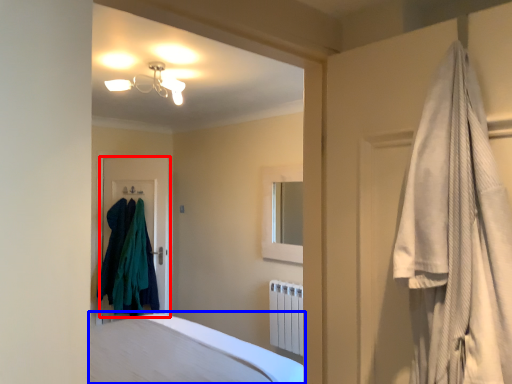
Question: Which point is closer to the camera, door (highlighted by a red box) or bed (highlighted by a blue box)?

Choices:
 (A) door
 (B) bed

Answer: (B)